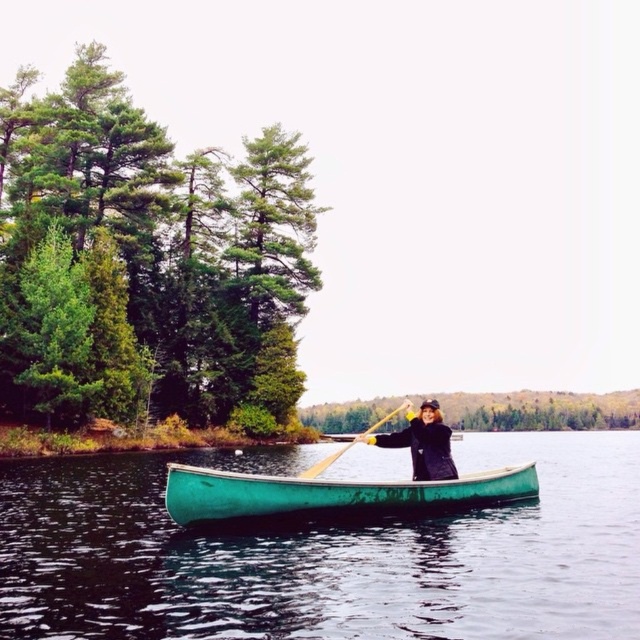
You are standing on the lakeshore and see the green polished wood canoe at center and the wooden at center in the water. Which object is closer to you?

The green polished wood canoe at center is closer to you because it is located above the wooden at center, meaning it is positioned higher up in the water closer to your viewpoint on the lakeshore.

You are an observer standing on the lakeside. You see the green polished wood canoe at center and the wooden at center. Which object is located to the right of the other?

The green polished wood canoe at center is positioned on the left side of wooden at center, so the wooden at center is to the right of the green polished wood canoe at center.

You are a photographer taking a picture of the black matte jacket at center and the wooden at center. Which object should you focus on first if you want to capture both in sharp focus?

The black matte jacket at center is above wooden at center, so focusing on the wooden at center first would ensure both are in sharp focus as it is closer to the camera.